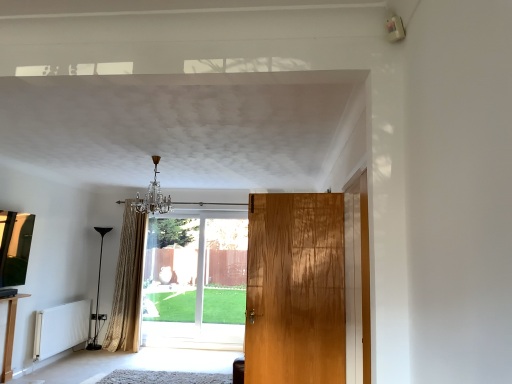
Question: Is white matte radiator at lower left not close to clear glass door at center, positioned as the 2th door in front-to-back order?

Choices:
 (A) yes
 (B) no

Answer: (A)

Question: Is white matte radiator at lower left with clear glass door at center, positioned as the 2th door in front-to-back order?

Choices:
 (A) yes
 (B) no

Answer: (B)

Question: Can you confirm if white matte radiator at lower left is thinner than clear glass door at center, positioned as the 2th door in front-to-back order?

Choices:
 (A) yes
 (B) no

Answer: (B)

Question: Is the depth of white matte radiator at lower left greater than that of clear glass door at center, positioned as the 2th door in front-to-back order?

Choices:
 (A) yes
 (B) no

Answer: (B)

Question: Does white matte radiator at lower left have a greater height compared to clear glass door at center, marked as the second door in a right-to-left arrangement?

Choices:
 (A) no
 (B) yes

Answer: (A)

Question: Does point (138, 198) appear closer or farther from the camera than point (6, 360)?

Choices:
 (A) closer
 (B) farther

Answer: (B)

Question: From the image's perspective, is crystal glass chandelier at upper center positioned above or below light brown wood table at lower left?

Choices:
 (A) below
 (B) above

Answer: (B)

Question: Considering the positions of crystal glass chandelier at upper center and light brown wood table at lower left in the image, is crystal glass chandelier at upper center bigger or smaller than light brown wood table at lower left?

Choices:
 (A) small
 (B) big

Answer: (B)

Question: Considering the relative positions of crystal glass chandelier at upper center and light brown wood table at lower left in the image provided, is crystal glass chandelier at upper center to the left or to the right of light brown wood table at lower left?

Choices:
 (A) left
 (B) right

Answer: (B)

Question: Is clear glass door at center, which ranks as the first door in left-to-right order, wider or thinner than white matte radiator at lower left?

Choices:
 (A) thin
 (B) wide

Answer: (A)

Question: From the image's perspective, is clear glass door at center, positioned as the 2th door in front-to-back order, positioned above or below white matte radiator at lower left?

Choices:
 (A) above
 (B) below

Answer: (A)

Question: Relative to white matte radiator at lower left, is clear glass door at center, which ranks as the first door in left-to-right order, in front or behind?

Choices:
 (A) front
 (B) behind

Answer: (B)

Question: From a real-world perspective, is clear glass door at center, arranged as the 1th door when viewed from the back, positioned above or below white matte radiator at lower left?

Choices:
 (A) below
 (B) above

Answer: (B)

Question: Considering their positions, is crystal glass chandelier at upper center located in front of or behind gold textured curtain at center?

Choices:
 (A) front
 (B) behind

Answer: (A)

Question: Considering the positions of point (160, 203) and point (110, 336), is point (160, 203) closer or farther from the camera than point (110, 336)?

Choices:
 (A) closer
 (B) farther

Answer: (A)